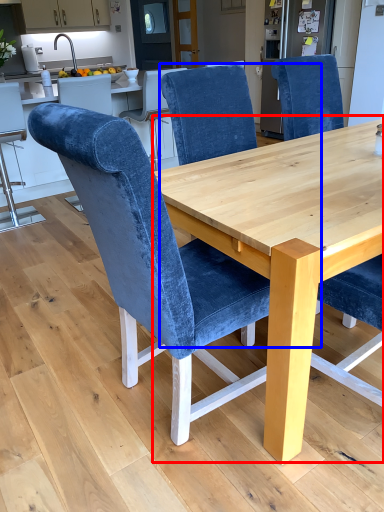
Question: Which object appears farthest to the camera in this image, round table (highlighted by a red box) or chair (highlighted by a blue box)?

Choices:
 (A) round table
 (B) chair

Answer: (B)